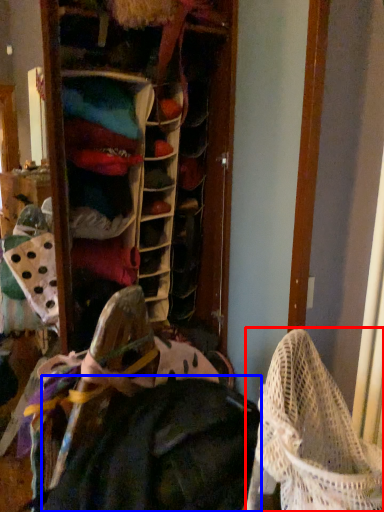
Question: Which point is further to the camera, baby carriage (highlighted by a red box) or clothing (highlighted by a blue box)?

Choices:
 (A) baby carriage
 (B) clothing

Answer: (B)